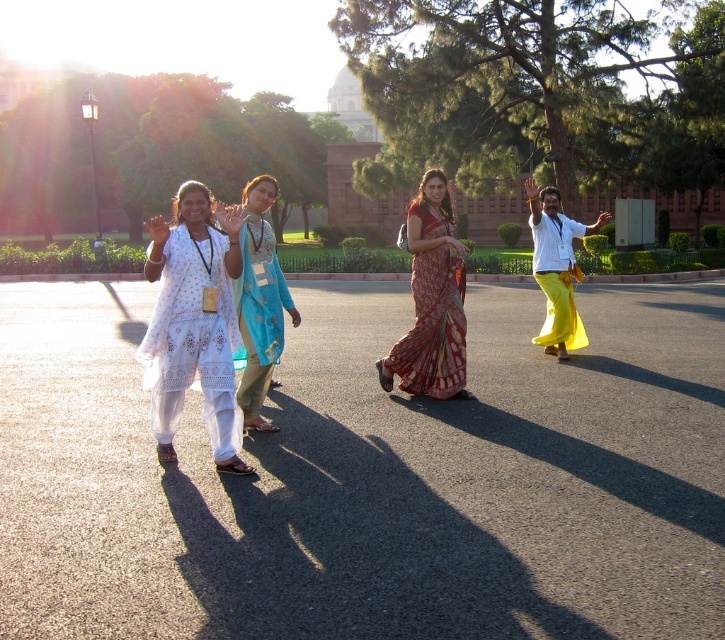
Is printed silk saree at center bigger than blue floral dress at center?

Correct, printed silk saree at center is larger in size than blue floral dress at center.

The width and height of the screenshot is (725, 640). What do you see at coordinates (431, 300) in the screenshot? I see `printed silk saree at center` at bounding box center [431, 300].

Image resolution: width=725 pixels, height=640 pixels. Identify the location of printed silk saree at center. (431, 300).

Between white lace kurta at center and blue floral dress at center, which one appears on the left side from the viewer's perspective?

Positioned to the left is white lace kurta at center.

Consider the image. Is white lace kurta at center positioned at the back of blue floral dress at center?

That is False.

Between point (181, 244) and point (257, 248), which one is positioned in front?

Point (181, 244) is in front.

Find the location of a particular element. The image size is (725, 640). white lace kurta at center is located at coordinates (194, 323).

Can you confirm if printed silk saree at center is thinner than yellow cotton saree at right?

Indeed, printed silk saree at center has a lesser width compared to yellow cotton saree at right.

Does printed silk saree at center lie in front of yellow cotton saree at right?

Yes, it is.

Where is `printed silk saree at center`? The height and width of the screenshot is (640, 725). printed silk saree at center is located at coordinates (431, 300).

The height and width of the screenshot is (640, 725). I want to click on printed silk saree at center, so click(431, 300).